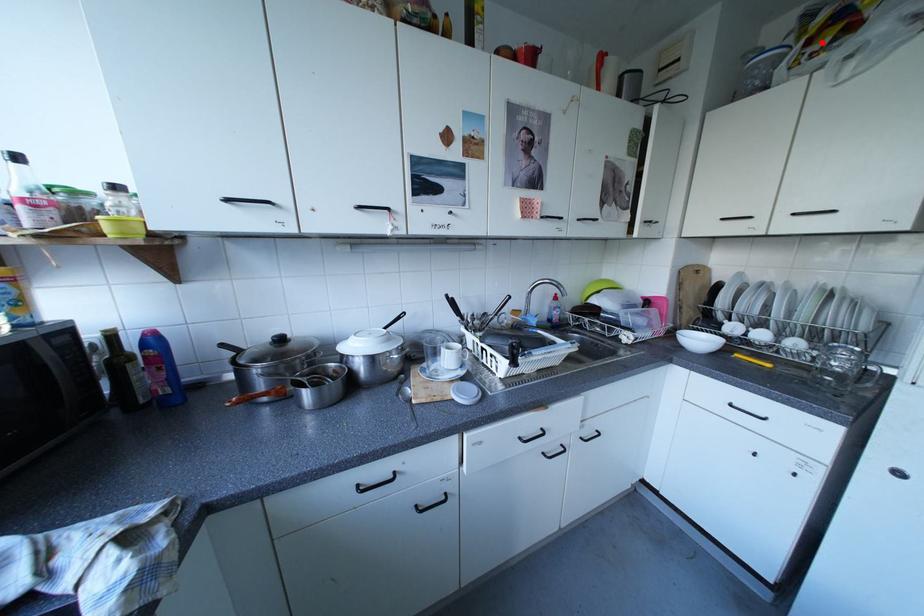
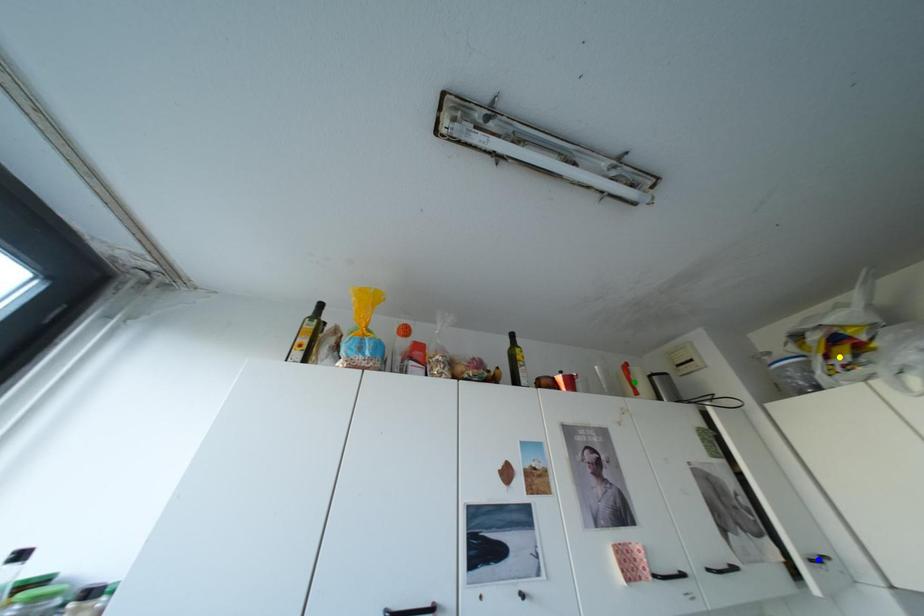
Question: I am providing you with two images of the same scene from different viewpoints. A red point is marked on the first image. You are given multiple points on the second image. Can you choose the point in image 2 that corresponds to the point in image 1?

Choices:
 (A) green point
 (B) blue point
 (C) yellow point

Answer: (C)